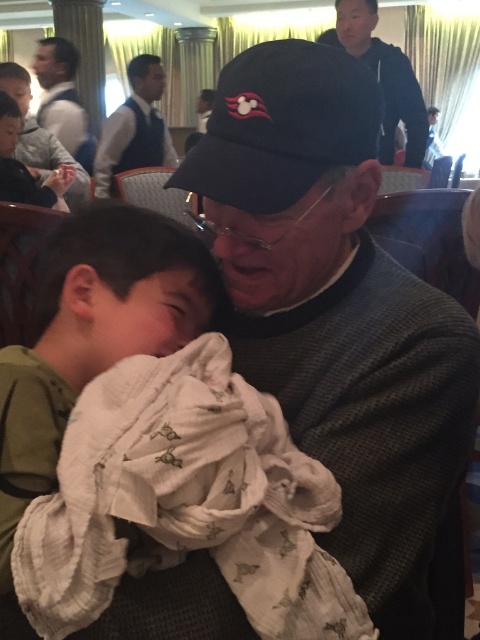
Which is behind, point (81, 296) or point (375, 452)?

The point (81, 296) is more distant.

Who is shorter, white cotton blanket at center or black knitwear at center?

With less height is white cotton blanket at center.

What do you see at coordinates (153, 444) in the screenshot? I see `white cotton blanket at center` at bounding box center [153, 444].

This screenshot has height=640, width=480. What are the coordinates of `white cotton blanket at center` in the screenshot? It's located at (153, 444).

Does matte black vest at upper left have a smaller size compared to matte black shirt at upper left?

No, matte black vest at upper left is not smaller than matte black shirt at upper left.

Which is above, matte black vest at upper left or matte black shirt at upper left?

matte black shirt at upper left

What do you see at coordinates (134, 128) in the screenshot?
I see `matte black vest at upper left` at bounding box center [134, 128].

Identify the location of matte black vest at upper left. (134, 128).

Is point (392, 104) farther from viewer compared to point (70, 84)?

No, it is not.

Can you confirm if dark blue sweater at upper center is smaller than matte black shirt at upper left?

Incorrect, dark blue sweater at upper center is not smaller in size than matte black shirt at upper left.

The height and width of the screenshot is (640, 480). What do you see at coordinates (384, 77) in the screenshot? I see `dark blue sweater at upper center` at bounding box center [384, 77].

This screenshot has height=640, width=480. I want to click on dark blue sweater at upper center, so (x=384, y=77).